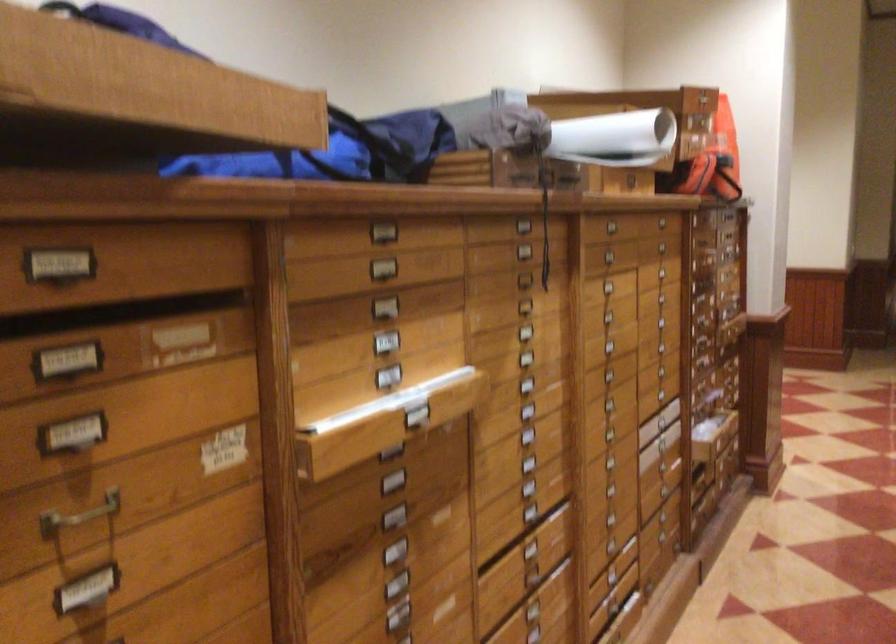
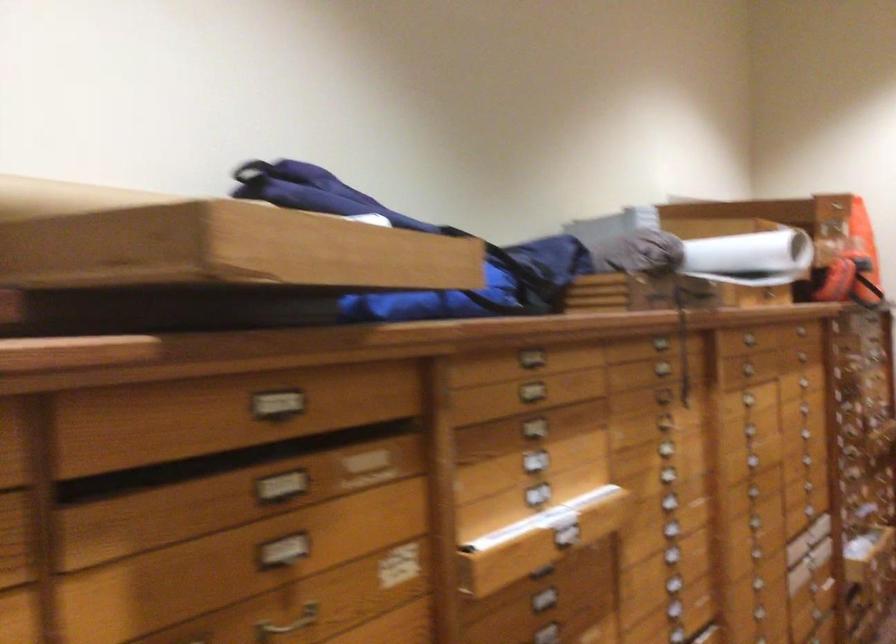
Question: Based on the continuous images, in which direction is the camera rotating? Reply with the corresponding letter.

Choices:
 (A) Left
 (B) Right
 (C) Up
 (D) Down

Answer: (A)